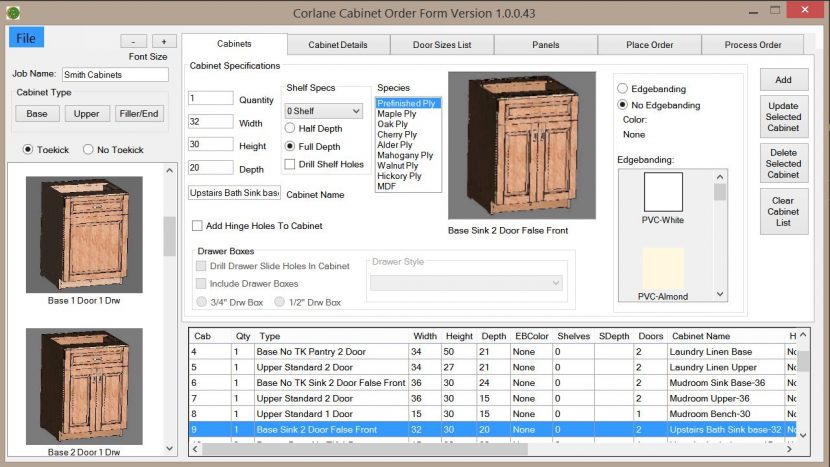
The height and width of the screenshot is (467, 830). What are the coordinates of `wood cabinet` in the screenshot? It's located at (543, 166), (79, 253), (80, 396).